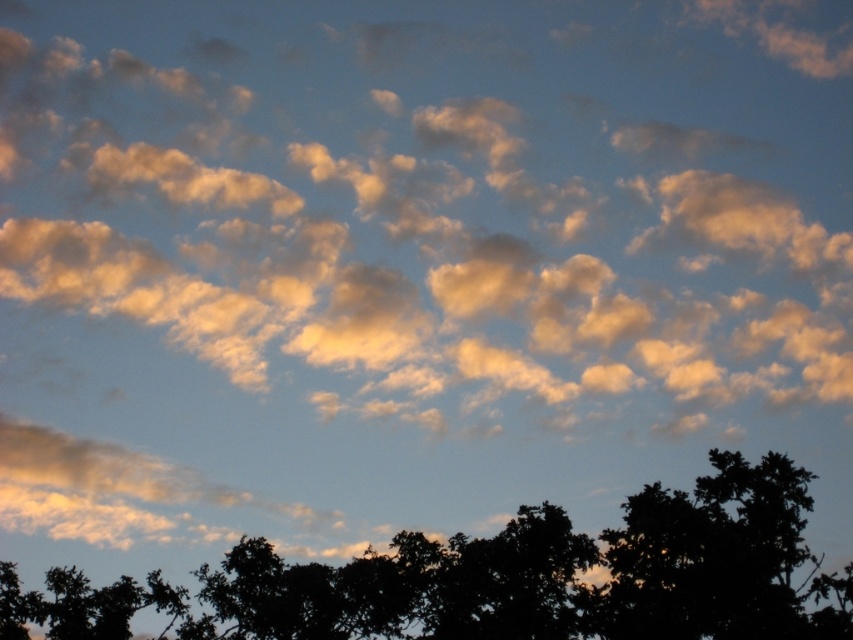
In the scene shown: You are standing in front of the sky scene and want to touch the two points labeled as point (74, 70) and point (30, 598). Which point should you reach for first if you want to touch the one closer to you?

You should reach for point (74, 70) first because it is closer to you than point (30, 598).